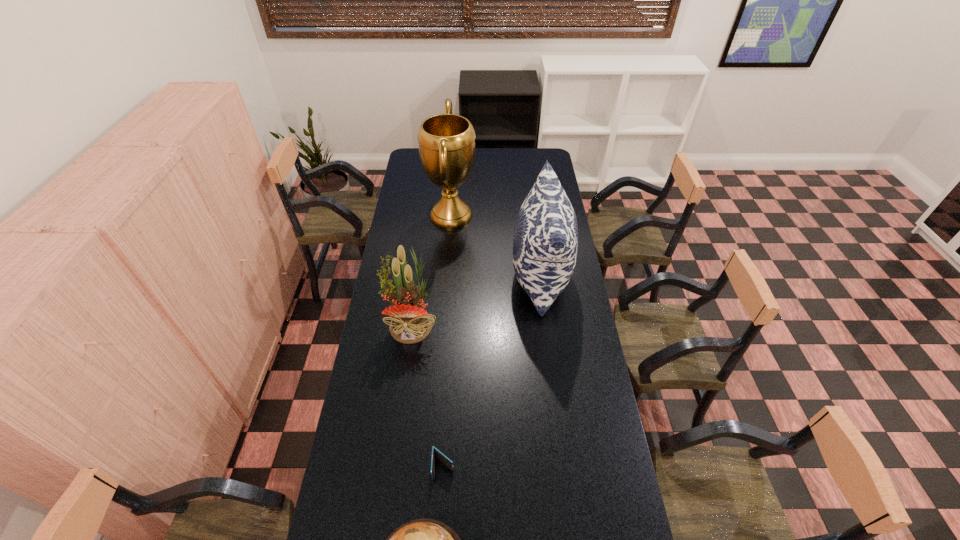
Locate an element on the screen. the tallest object is located at coordinates (446, 142).

Find the location of a particular element. the rightmost object is located at coordinates (545, 246).

Locate an element on the screen. flower arrangement is located at coordinates (410, 323).

Where is `wallet`? wallet is located at coordinates (446, 461).

You are a GUI agent. You are given a task and a screenshot of the screen. Output one action in this format:
    pyautogui.click(x=<x>, y=<y>)
    Task: Click on the second nearest object
    The width and height of the screenshot is (960, 540).
    Given the screenshot: What is the action you would take?
    pyautogui.click(x=446, y=461)

Image resolution: width=960 pixels, height=540 pixels. What are the coordinates of `free location located 0.350m on the surface of the trophy cup with symbols` in the screenshot? It's located at (543, 215).

Identify the location of vacant space located 0.270m on the front surface of the cushion. (450, 276).

Where is `vacant region located on the front surface of the cushion`? This screenshot has height=540, width=960. vacant region located on the front surface of the cushion is located at coordinates (446, 276).

The width and height of the screenshot is (960, 540). In order to click on vacant space located on the front surface of the cushion in this screenshot , I will do `click(444, 276)`.

Where is `free space located in front of the flower arrangement with the fan visible`? The image size is (960, 540). free space located in front of the flower arrangement with the fan visible is located at coordinates (403, 391).